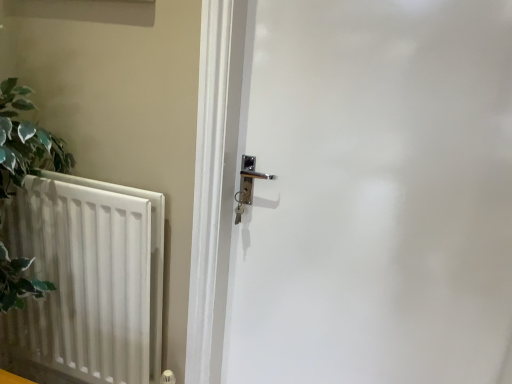
Where is `white glossy door at center`? The image size is (512, 384). white glossy door at center is located at coordinates (376, 195).

Consider the image. Measure the distance between white glossy door at center and camera.

white glossy door at center is 93.96 centimeters away from camera.

This screenshot has width=512, height=384. Describe the element at coordinates (376, 195) in the screenshot. I see `white glossy door at center` at that location.

Measure the distance between white matte radiator at left and camera.

white matte radiator at left and camera are 1.14 meters apart.

Describe the element at coordinates (89, 278) in the screenshot. Image resolution: width=512 pixels, height=384 pixels. I see `white matte radiator at left` at that location.

Where is `white matte radiator at left`? white matte radiator at left is located at coordinates [89, 278].

Image resolution: width=512 pixels, height=384 pixels. In order to click on white glossy door at center in this screenshot , I will do `click(376, 195)`.

Is white matte radiator at left to the left of white glossy door at center from the viewer's perspective?

Yes.

Considering the positions of objects white matte radiator at left and white glossy door at center in the image provided, who is behind, white matte radiator at left or white glossy door at center?

white matte radiator at left.

Is point (83, 214) behind point (284, 132)?

Yes, point (83, 214) is farther from viewer.

From the image's perspective, is white matte radiator at left on top of white glossy door at center?

No, from the image's perspective, white matte radiator at left is not on top of white glossy door at center.

From a real-world perspective, is white matte radiator at left on white glossy door at center?

No, from a real-world perspective, white matte radiator at left is not on top of white glossy door at center.

Considering the sizes of white matte radiator at left and white glossy door at center in the image, is white matte radiator at left wider or thinner than white glossy door at center?

In the image, white matte radiator at left appears to be more narrow than white glossy door at center.

Who is shorter, white matte radiator at left or white glossy door at center?

With less height is white matte radiator at left.

Can you confirm if white matte radiator at left is bigger than white glossy door at center?

Incorrect, white matte radiator at left is not larger than white glossy door at center.

Is white glossy door at center a part of white matte radiator at left?

That's incorrect, white glossy door at center is not inside white matte radiator at left.

Is white matte radiator at left touching white glossy door at center?

No, white matte radiator at left is not beside white glossy door at center.

Is white matte radiator at left oriented away from white glossy door at center?

No, white matte radiator at left is not facing the opposite direction of white glossy door at center.

Measure the distance between white matte radiator at left and white glossy door at center.

The distance of white matte radiator at left from white glossy door at center is 22.73 inches.

Where is `door in front of the white matte radiator at left`? This screenshot has height=384, width=512. door in front of the white matte radiator at left is located at coordinates (x=376, y=195).

Considering the positions of objects white glossy door at center and white matte radiator at left in the image provided, who is more to the right, white glossy door at center or white matte radiator at left?

white glossy door at center is more to the right.

Which is in front, white glossy door at center or white matte radiator at left?

white glossy door at center is closer to the camera.

Is point (494, 334) positioned behind point (72, 308)?

No.

From the image's perspective, does white glossy door at center appear lower than white matte radiator at left?

No.

From a real-world perspective, which object stands above the other?

In real-world perspective, white glossy door at center is above.

Looking at their sizes, would you say white glossy door at center is wider or thinner than white matte radiator at left?

Clearly, white glossy door at center has more width compared to white matte radiator at left.

Who is shorter, white glossy door at center or white matte radiator at left?

With less height is white matte radiator at left.

Considering the sizes of white glossy door at center and white matte radiator at left in the image, is white glossy door at center bigger or smaller than white matte radiator at left?

white glossy door at center is bigger than white matte radiator at left.

Choose the correct answer: Is white glossy door at center inside white matte radiator at left or outside it?

white glossy door at center is located beyond the bounds of white matte radiator at left.

Is white glossy door at center beside white matte radiator at left?

white glossy door at center and white matte radiator at left are clearly separated.

From the picture: Is white glossy door at center looking in the opposite direction of white matte radiator at left?

No, white glossy door at center's orientation is not away from white matte radiator at left.

How different are the orientations of white glossy door at center and white matte radiator at left in degrees?

white glossy door at center and white matte radiator at left are facing 0.264 degrees away from each other.

Locate an element on the screen. This screenshot has width=512, height=384. door above the white matte radiator at left (from a real-world perspective) is located at coordinates (376, 195).

Find the location of `door on the right of white matte radiator at left`. door on the right of white matte radiator at left is located at coordinates (376, 195).

Locate an element on the screen. The width and height of the screenshot is (512, 384). door located above the white matte radiator at left (from a real-world perspective) is located at coordinates (376, 195).